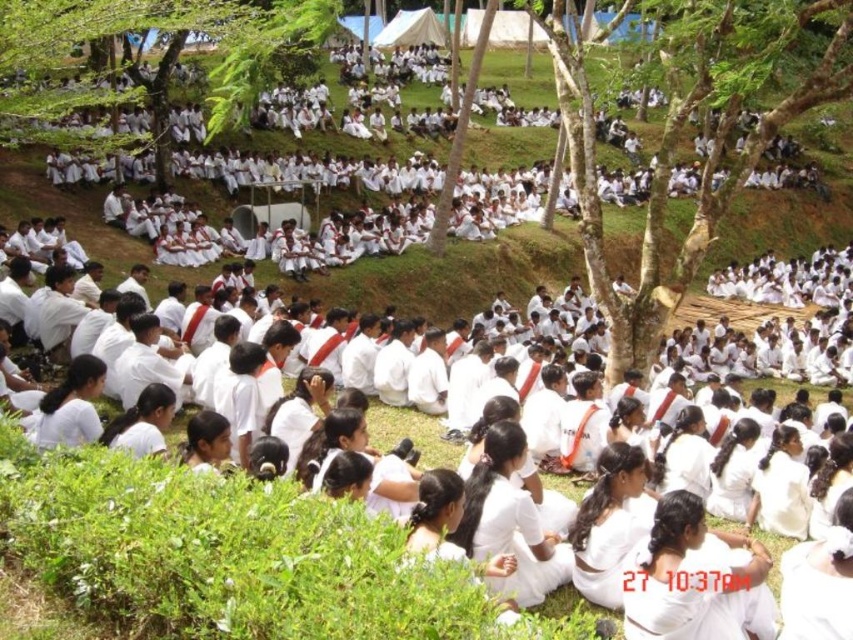
How distant is smooth bark tree at center from green leafy tree at upper left?

smooth bark tree at center is 35.12 meters from green leafy tree at upper left.

Based on the photo, who is positioned more to the left, smooth bark tree at center or green leafy tree at upper left?

From the viewer's perspective, green leafy tree at upper left appears more on the left side.

Does point (659, 262) lie behind point (219, 99)?

That is True.

Identify the location of smooth bark tree at center. (683, 125).